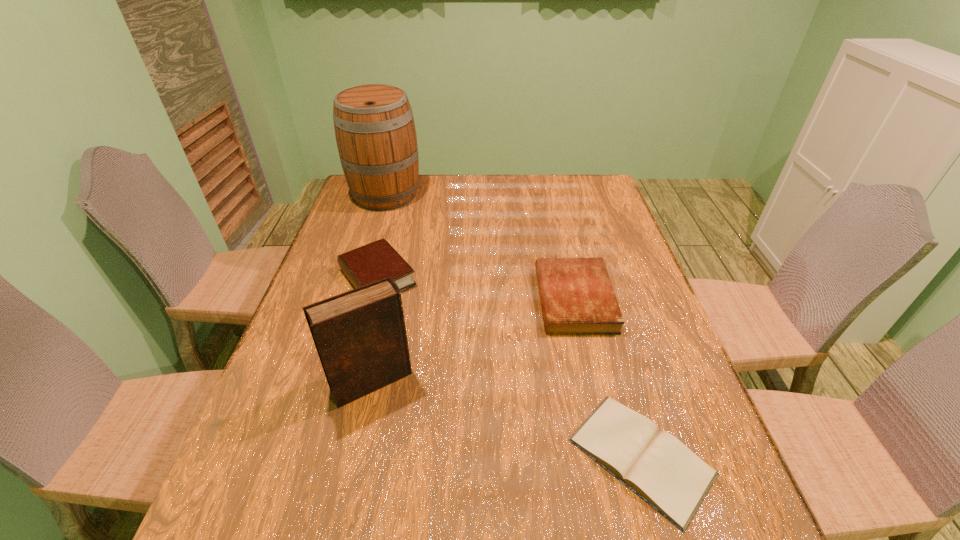
Identify the location of cider. (375, 132).

Find the location of a particular element. The width and height of the screenshot is (960, 540). the tallest object is located at coordinates (375, 132).

What are the coordinates of `the tallest Bible` in the screenshot? It's located at (360, 335).

Where is `the third tallest object`? the third tallest object is located at coordinates (377, 260).

Where is `the second shortest object`? Image resolution: width=960 pixels, height=540 pixels. the second shortest object is located at coordinates (577, 297).

Where is `the shortest Bible`? the shortest Bible is located at coordinates (655, 465).

Find the location of a particular element. free spot located 0.130m on the right of the tallest object is located at coordinates (458, 195).

Find the location of a particular element. The height and width of the screenshot is (540, 960). free spot located on the right of the second tallest object is located at coordinates (452, 381).

This screenshot has width=960, height=540. In order to click on vacant region located on the front of the third tallest object in this screenshot , I will do `click(360, 343)`.

Identify the location of vacant space located 0.280m on the spine side of the third tallest Bible. coord(434,299).